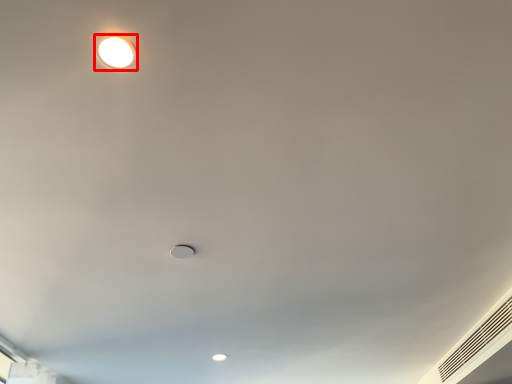
Question: From the image, what is the correct spatial relationship of lamp (annotated by the red box) in relation to air conditioning?

Choices:
 (A) right
 (B) left

Answer: (B)